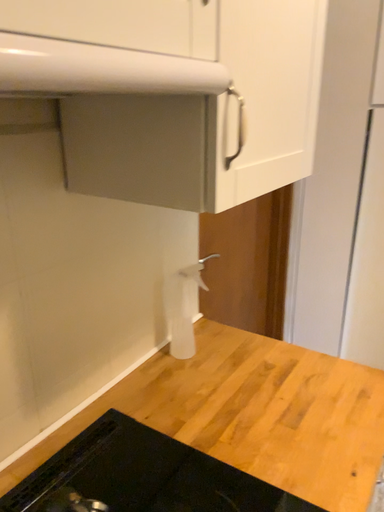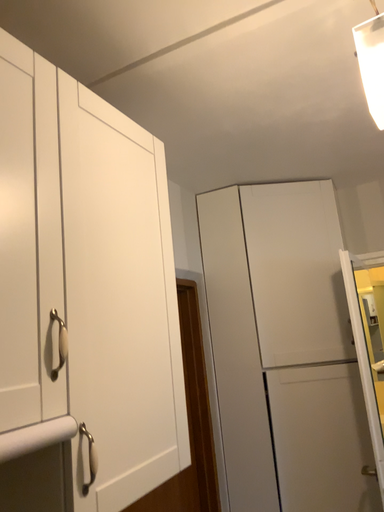
Question: Which way did the camera rotate in the video?

Choices:
 (A) rotated downward
 (B) rotated upward

Answer: (B)